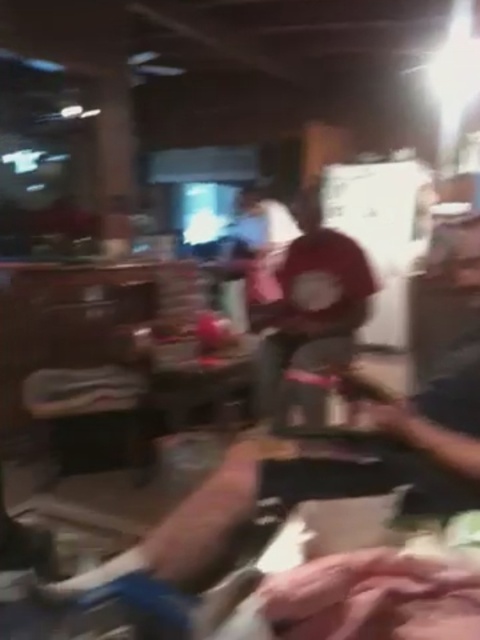
Question: Is red cotton shirt at center to the left of dark blue shirt at right from the viewer's perspective?

Choices:
 (A) no
 (B) yes

Answer: (B)

Question: Which object appears farthest from the camera in this image?

Choices:
 (A) red cotton shirt at center
 (B) dark blue shirt at right

Answer: (A)

Question: Can you confirm if red cotton shirt at center is smaller than dark blue shirt at right?

Choices:
 (A) yes
 (B) no

Answer: (B)

Question: Can you confirm if red cotton shirt at center is wider than dark blue shirt at right?

Choices:
 (A) no
 (B) yes

Answer: (B)